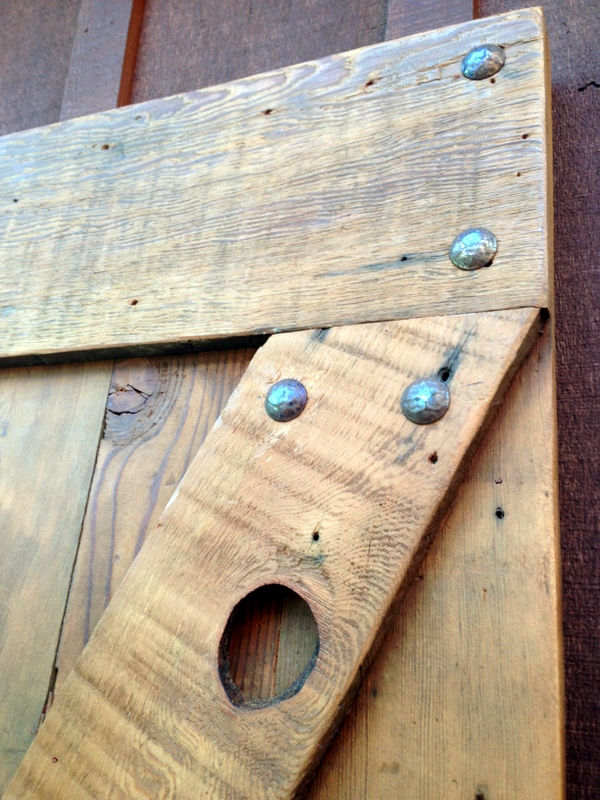
Identify the location of door. Image resolution: width=600 pixels, height=800 pixels. (308, 534).